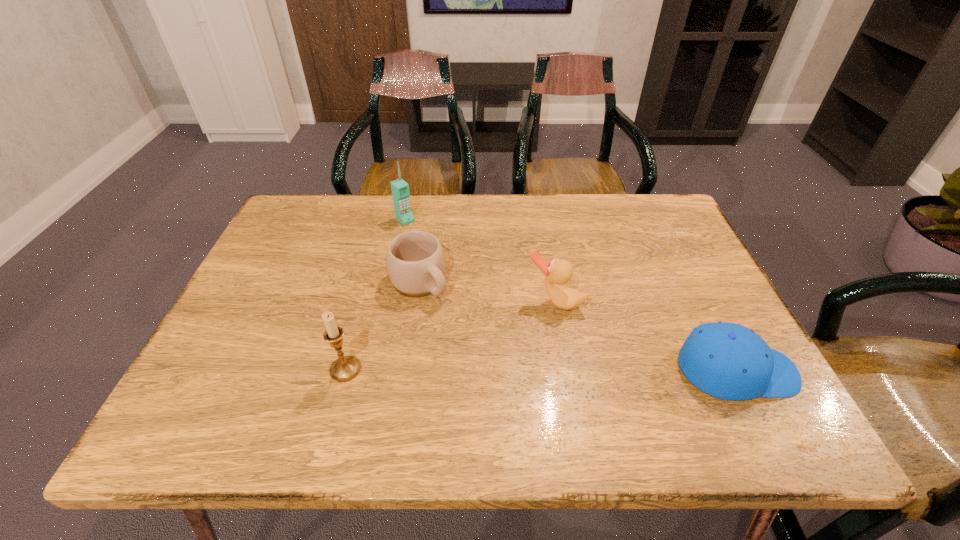
Locate an element on the screen. free spot at the far edge of the desktop is located at coordinates (561, 195).

At what (x,y) coordinates should I click in order to perform the action: click on vacant space at the near edge of the desktop. Please return your answer as a coordinate pair (x, y). This screenshot has height=540, width=960. Looking at the image, I should click on (x=279, y=370).

Find the location of `free region at the left edge`. free region at the left edge is located at coordinates (238, 318).

Where is `free point at the right edge`? The height and width of the screenshot is (540, 960). free point at the right edge is located at coordinates (674, 251).

In order to click on vacant space at the far left corner in this screenshot , I will do [318, 227].

I want to click on blank space at the near left corner of the desktop, so click(x=256, y=377).

You are a GUI agent. You are given a task and a screenshot of the screen. Output one action in this format:
    pyautogui.click(x=<x>, y=<y>)
    Task: Click on the vacant space in between the candle holder and the cap
    This screenshot has width=960, height=540.
    Given the screenshot: What is the action you would take?
    pyautogui.click(x=540, y=370)

Where is `free space between the candle holder and the mug`? free space between the candle holder and the mug is located at coordinates (382, 326).

Locate an element on the screen. The height and width of the screenshot is (540, 960). vacant region between the candle holder and the duck is located at coordinates (450, 336).

Locate an element on the screen. vacant region between the second object from right to left and the cap is located at coordinates (646, 336).